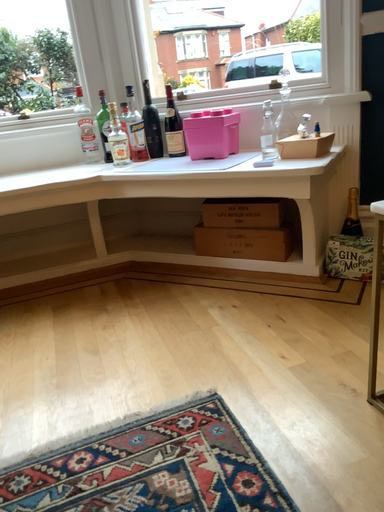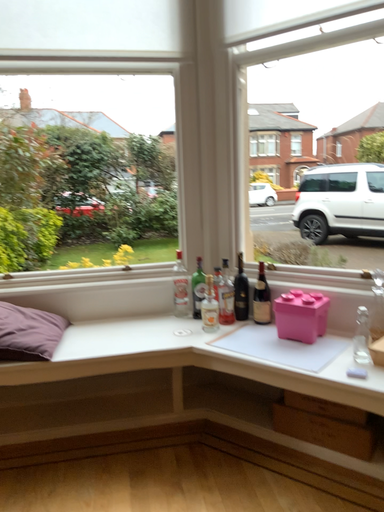
Question: How did the camera likely rotate when shooting the video?

Choices:
 (A) rotated upward
 (B) rotated downward

Answer: (A)